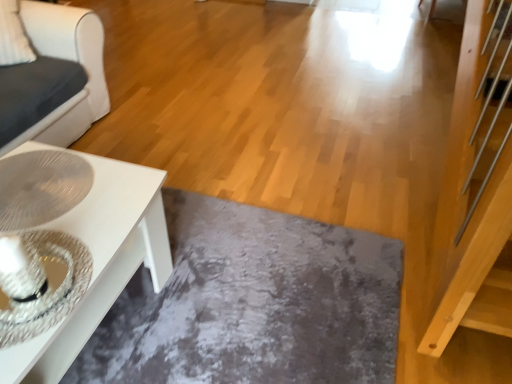
The width and height of the screenshot is (512, 384). I want to click on empty space that is ontop of white glossy table at lower left (from a real-world perspective), so click(x=59, y=205).